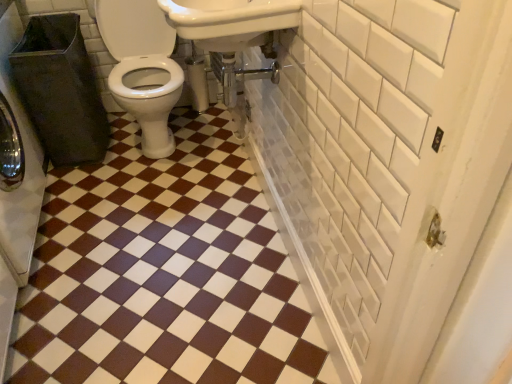
Question: Could black plastic trash can at left be considered to be inside white glossy sink at upper center?

Choices:
 (A) no
 (B) yes

Answer: (A)

Question: Can you confirm if white glossy sink at upper center is positioned to the right of black plastic trash can at left?

Choices:
 (A) no
 (B) yes

Answer: (B)

Question: From a real-world perspective, is white glossy sink at upper center physically above black plastic trash can at left?

Choices:
 (A) no
 (B) yes

Answer: (B)

Question: Is white glossy sink at upper center far away from black plastic trash can at left?

Choices:
 (A) yes
 (B) no

Answer: (B)

Question: Is white glossy sink at upper center positioned in front of black plastic trash can at left?

Choices:
 (A) yes
 (B) no

Answer: (A)

Question: Considering the relative sizes of white glossy sink at upper center and black plastic trash can at left in the image provided, is white glossy sink at upper center bigger than black plastic trash can at left?

Choices:
 (A) yes
 (B) no

Answer: (B)

Question: Would you consider black plastic trash can at left to be distant from white glossy sink at upper center?

Choices:
 (A) no
 (B) yes

Answer: (A)

Question: Can you confirm if black plastic trash can at left is smaller than white glossy sink at upper center?

Choices:
 (A) yes
 (B) no

Answer: (B)

Question: Is black plastic trash can at left taller than white glossy sink at upper center?

Choices:
 (A) yes
 (B) no

Answer: (A)

Question: Considering the relative sizes of black plastic trash can at left and white glossy sink at upper center in the image provided, is black plastic trash can at left bigger than white glossy sink at upper center?

Choices:
 (A) yes
 (B) no

Answer: (A)

Question: Is black plastic trash can at left at the left side of white glossy sink at upper center?

Choices:
 (A) no
 (B) yes

Answer: (B)

Question: Considering the relative sizes of black plastic trash can at left and white glossy sink at upper center in the image provided, is black plastic trash can at left thinner than white glossy sink at upper center?

Choices:
 (A) no
 (B) yes

Answer: (B)

Question: Is white matte toilet paper at center touching white glossy sink at upper center?

Choices:
 (A) yes
 (B) no

Answer: (B)